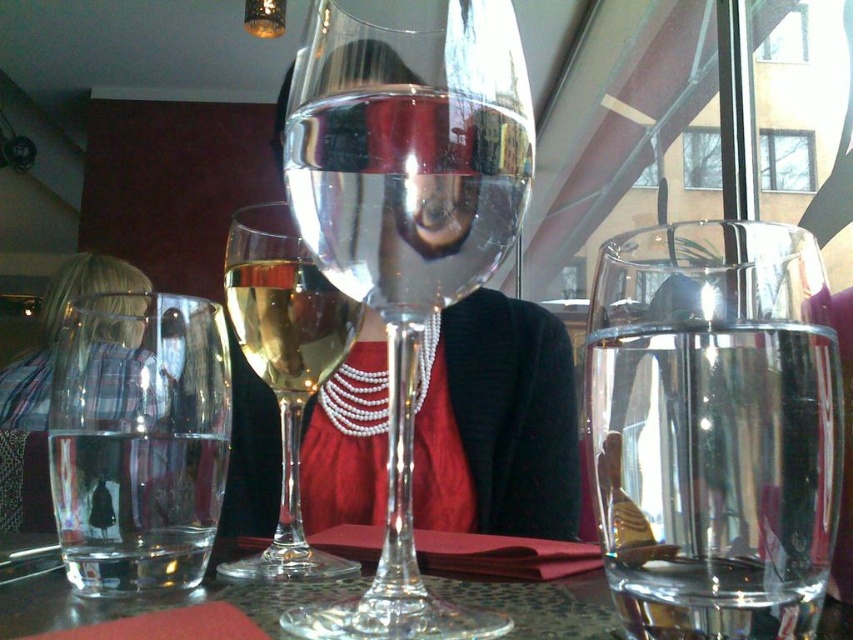
Does transparent glass wine glass at center lie behind translucent glass wine glass at center?

No, transparent glass wine glass at center is closer to the viewer.

Can you confirm if transparent glass wine glass at center is positioned below translucent glass wine glass at center?

No.

Image resolution: width=853 pixels, height=640 pixels. In order to click on transparent glass wine glass at center in this screenshot , I will do `click(405, 225)`.

Is transparent glass wine glass at center smaller than clear glass wine at center?

No.

Which is above, transparent glass wine glass at center or clear glass wine at center?

Positioned higher is clear glass wine at center.

The height and width of the screenshot is (640, 853). I want to click on transparent glass wine glass at center, so click(405, 225).

The height and width of the screenshot is (640, 853). I want to click on transparent glass wine glass at center, so click(405, 225).

Which is more to the right, transparent glass wine glass at center or clear glass water at center?

From the viewer's perspective, clear glass water at center appears more on the right side.

Is transparent glass wine glass at center taller than clear glass water at center?

Yes.

Locate an element on the screen. transparent glass wine glass at center is located at coordinates (405, 225).